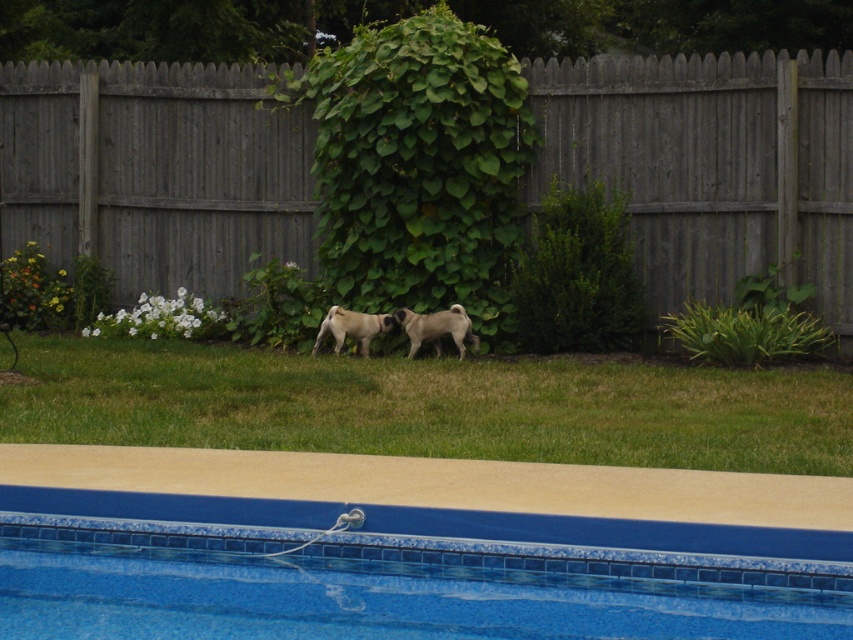
You are a drone operator trying to capture a photo of the black fur pug at center and the green grass at center. Which object should you focus on first to ensure both are in the frame?

The green grass at center is in front of the black fur pug at center, so you should focus on the black fur pug at center first to ensure both are in the frame.

You are standing at the point closest to the pool deck. Which point, point (434,342) or point (343,332), is farther away from you?

Point (434,342) is behind point (343,332), so it is farther away from you.